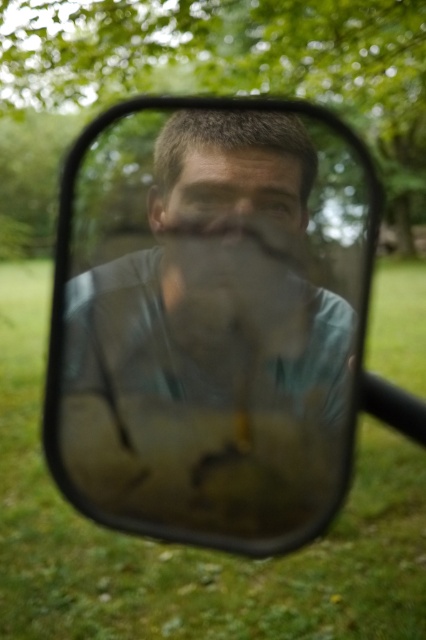
Question: Among these points, which one is nearest to the camera?

Choices:
 (A) (259, 545)
 (B) (131, 72)
 (C) (239, 154)

Answer: (A)

Question: Does green leafy tree at upper center have a lesser width compared to smooth skin face at center?

Choices:
 (A) yes
 (B) no

Answer: (B)

Question: Which point is farther to the camera?

Choices:
 (A) smooth skin face at center
 (B) green leafy tree at upper center
 (C) clear glass mirror at center

Answer: (B)

Question: Does clear glass mirror at center appear on the right side of green leafy tree at upper center?

Choices:
 (A) yes
 (B) no

Answer: (B)

Question: Is clear glass mirror at center smaller than smooth skin face at center?

Choices:
 (A) yes
 (B) no

Answer: (B)

Question: Which of these objects is positioned closest to the clear glass mirror at center?

Choices:
 (A) green leafy tree at upper center
 (B) smooth skin face at center

Answer: (B)